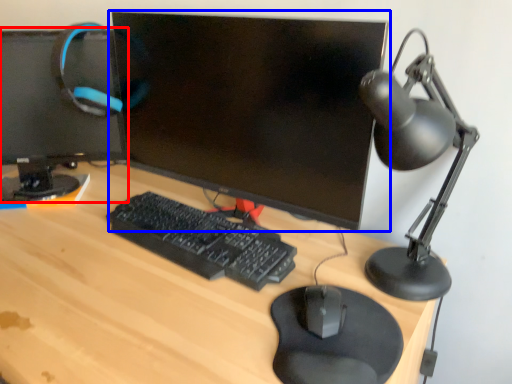
Question: Which object appears closest to the camera in this image, computer monitor (highlighted by a red box) or computer monitor (highlighted by a blue box)?

Choices:
 (A) computer monitor
 (B) computer monitor

Answer: (B)